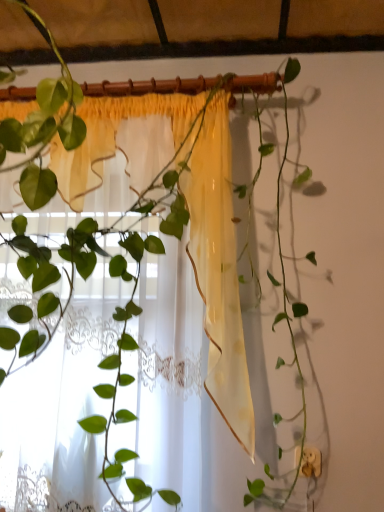
The width and height of the screenshot is (384, 512). I want to click on translucent yellow curtain at upper center, so click(131, 255).

What do you see at coordinates (131, 255) in the screenshot? The image size is (384, 512). I see `translucent yellow curtain at upper center` at bounding box center [131, 255].

Locate an element on the screen. The width and height of the screenshot is (384, 512). translucent yellow curtain at upper center is located at coordinates (131, 255).